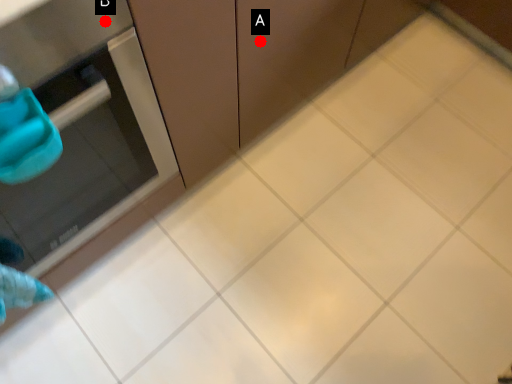
Question: Two points are circled on the image, labeled by A and B beside each circle. Which point is farther to the camera?

Choices:
 (A) A is further
 (B) B is further

Answer: (A)